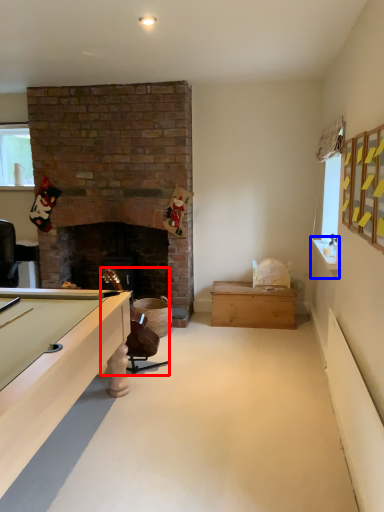
Question: Which point is closer to the camera, chair (highlighted by a red box) or counter top (highlighted by a blue box)?

Choices:
 (A) chair
 (B) counter top

Answer: (B)